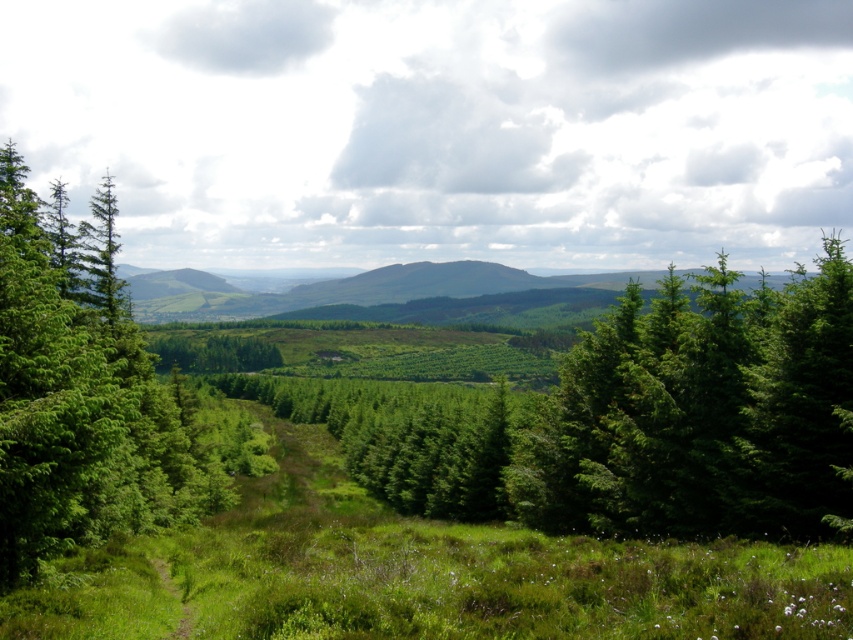
Is green matte tree at center to the left of green leafy tree at left from the viewer's perspective?

No, green matte tree at center is not to the left of green leafy tree at left.

Where is `green matte tree at center`? The width and height of the screenshot is (853, 640). green matte tree at center is located at coordinates (699, 412).

Is point (556, 410) positioned before point (32, 362)?

That is False.

Find the location of `green matte tree at center`. green matte tree at center is located at coordinates (699, 412).